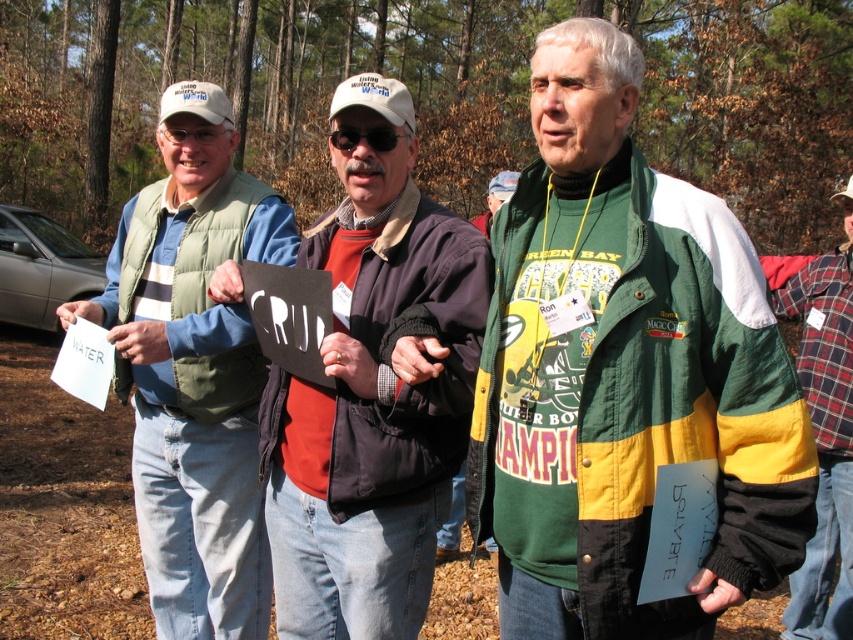
Question: Among these objects, which one is farthest from the camera?

Choices:
 (A) green matte vest at left
 (B) dark brown leather jacket at center
 (C) green/yellow/white jacket at center

Answer: (A)

Question: Can you confirm if green matte vest at left is positioned below flannel shirt at center?

Choices:
 (A) no
 (B) yes

Answer: (A)

Question: Is green/yellow/white jacket at center above flannel shirt at center?

Choices:
 (A) yes
 (B) no

Answer: (A)

Question: Which object appears closest to the camera in this image?

Choices:
 (A) green matte vest at left
 (B) green/yellow/white jacket at center

Answer: (B)

Question: Is green/yellow/white jacket at center above dark brown leather jacket at center?

Choices:
 (A) no
 (B) yes

Answer: (B)

Question: Estimate the real-world distances between objects in this image. Which object is farther from the green/yellow/white jacket at center?

Choices:
 (A) dark brown leather jacket at center
 (B) flannel shirt at center

Answer: (B)